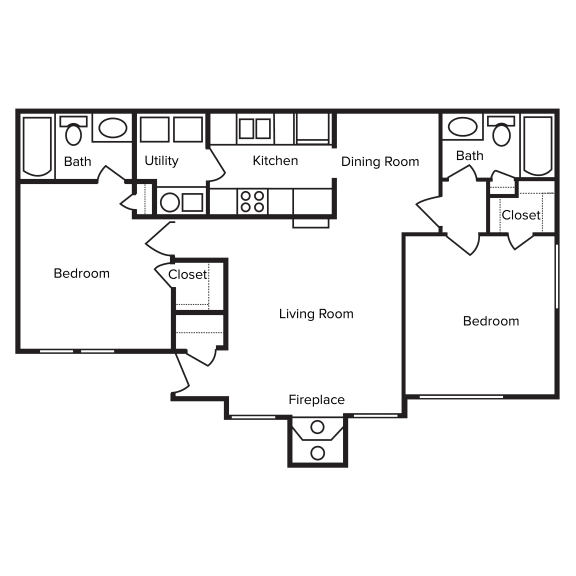
Find the location of a particular element. The height and width of the screenshot is (576, 576). closet is located at coordinates (181, 285), (518, 222).